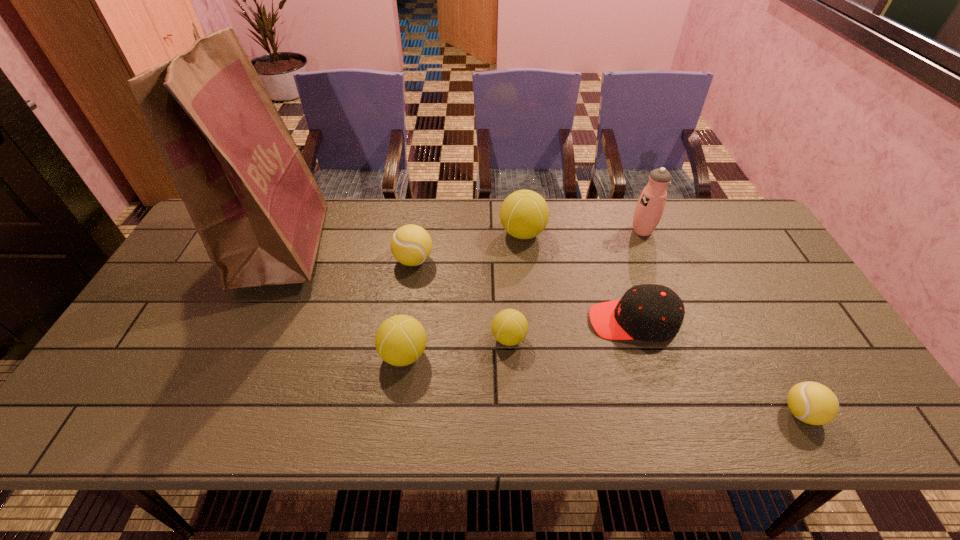
Where is `the right yellow tennis ball`? the right yellow tennis ball is located at coordinates (813, 403).

I want to click on the smallest green tennis ball, so click(509, 327).

Find the location of a particular element. Image resolution: width=960 pixels, height=540 pixels. blank space located 0.250m on the front-facing side of the leftmost object is located at coordinates (410, 245).

The width and height of the screenshot is (960, 540). In order to click on vacant region located on the right of the thermos bottle in this screenshot , I will do [733, 231].

Where is `blank space located on the right of the tallest tennis ball`? The width and height of the screenshot is (960, 540). blank space located on the right of the tallest tennis ball is located at coordinates (632, 233).

Find the location of `free location located 0.110m on the back of the bigger yellow tennis ball`. free location located 0.110m on the back of the bigger yellow tennis ball is located at coordinates (419, 224).

This screenshot has height=540, width=960. Identify the location of vacant space positioned on the front of the leftmost green tennis ball. pyautogui.click(x=395, y=424).

This screenshot has height=540, width=960. Identify the location of vacant point located on the front-facing side of the cap. (540, 321).

You are a GUI agent. You are given a task and a screenshot of the screen. Output one action in this format:
    pyautogui.click(x=<x>, y=<y>)
    Task: Click on the free point located 0.270m on the front-facing side of the cap
    
    Given the screenshot: What is the action you would take?
    [486, 321]

At what (x,y) coordinates should I click in order to perform the action: click on vacant space located 0.130m on the front-facing side of the cap. Please return your answer as a coordinate pair (x, y). This screenshot has height=540, width=960. Looking at the image, I should click on pos(540,321).